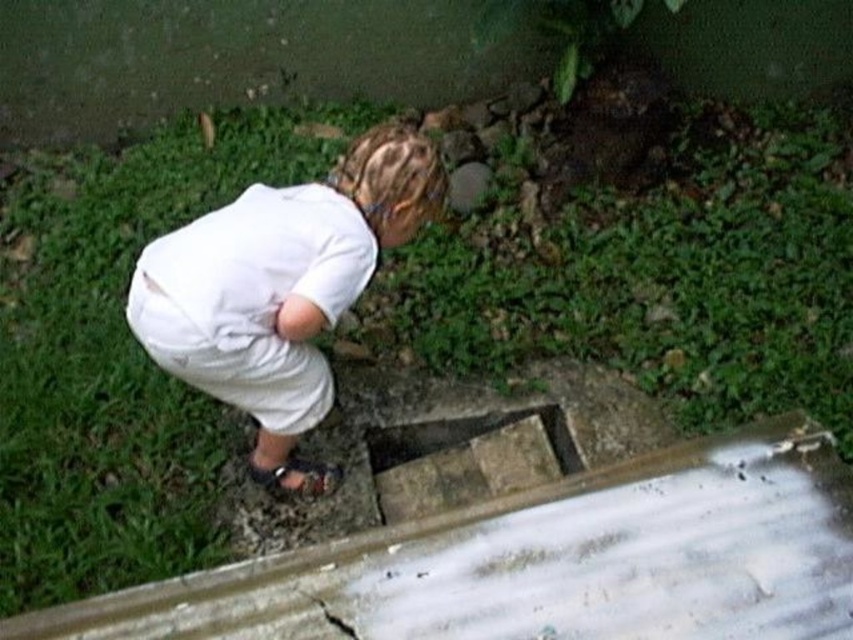
Question: Which point is closer to the camera?

Choices:
 (A) (524, 452)
 (B) (305, 481)
 (C) (350, 630)
 (D) (372, 269)

Answer: (C)

Question: Which point is closer to the camera?

Choices:
 (A) (285, 301)
 (B) (399, 502)
 (C) (294, 589)
 (D) (274, 481)

Answer: (C)

Question: Is brown leather sandal at lower center positioned before black matte crack at lower center?

Choices:
 (A) no
 (B) yes

Answer: (A)

Question: Does concrete rectangular hole at center have a larger size compared to black matte crack at lower center?

Choices:
 (A) yes
 (B) no

Answer: (A)

Question: Does white cotton shirt at center have a larger size compared to concrete rectangular hole at center?

Choices:
 (A) no
 (B) yes

Answer: (B)

Question: Estimate the real-world distances between objects in this image. Which object is farther from the white cotton shirt at center?

Choices:
 (A) concrete rectangular hole at center
 (B) black matte crack at lower center

Answer: (B)